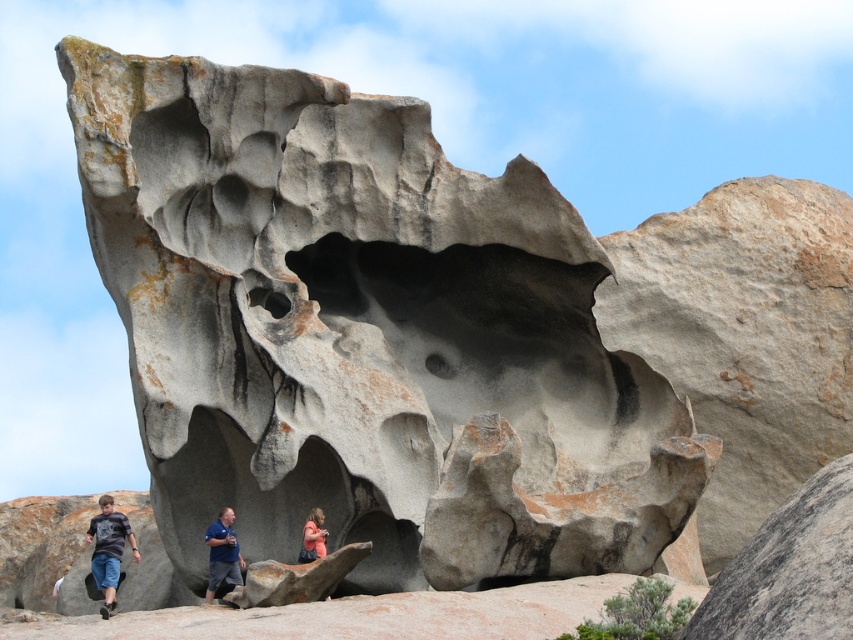
You are a photographer planning to take a picture of the gray rough rock at center and the pink fabric at center. Based on the scene description, which object should you focus on first to ensure both are in frame?

The gray rough rock at center is in front of the pink fabric at center, so you should focus on the gray rough rock at center first to ensure both are in frame.